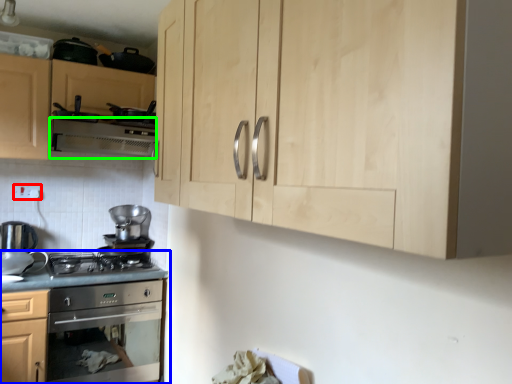
Question: Estimate the real-world distances between objects in this image. Which object is closer to electric outlet (highlighted by a red box), countertop (highlighted by a blue box) or exhaust hood (highlighted by a green box)?

Choices:
 (A) countertop
 (B) exhaust hood

Answer: (B)